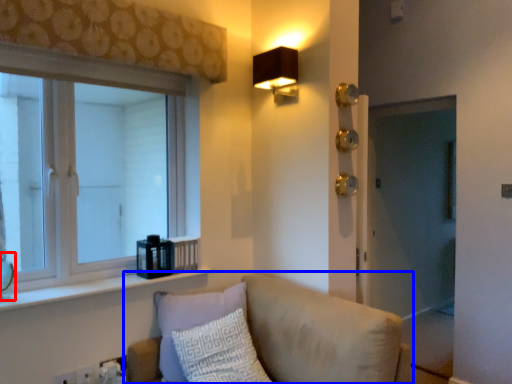
Question: Which object appears farthest to the camera in this image, glass vase (highlighted by a red box) or studio couch (highlighted by a blue box)?

Choices:
 (A) glass vase
 (B) studio couch

Answer: (A)